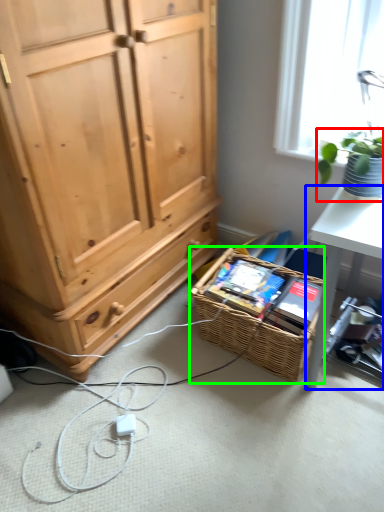
Question: Considering the real-world distances, which object is closest to houseplant (highlighted by a red box)? desk (highlighted by a blue box) or picnic basket (highlighted by a green box).

Choices:
 (A) desk
 (B) picnic basket

Answer: (A)